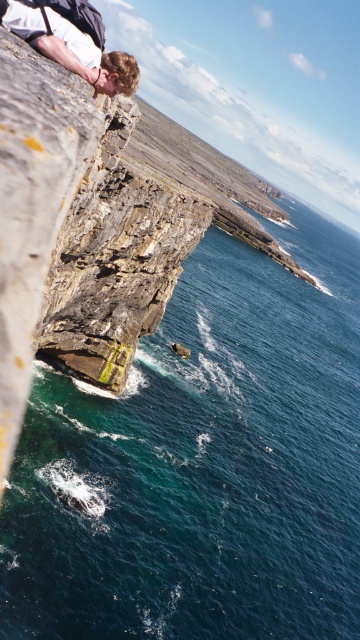
Question: Observing the image, what is the correct spatial positioning of blue water at lower left in reference to matte white shirt at upper left?

Choices:
 (A) below
 (B) above

Answer: (A)

Question: Which point appears farthest from the camera in this image?

Choices:
 (A) (55, 481)
 (B) (99, 77)

Answer: (A)

Question: Among these points, which one is farthest from the camera?

Choices:
 (A) (307, 381)
 (B) (50, 44)

Answer: (A)

Question: Is blue water at lower left smaller than matte white shirt at upper left?

Choices:
 (A) no
 (B) yes

Answer: (A)

Question: Can you confirm if blue water at lower left is positioned above matte white shirt at upper left?

Choices:
 (A) no
 (B) yes

Answer: (A)